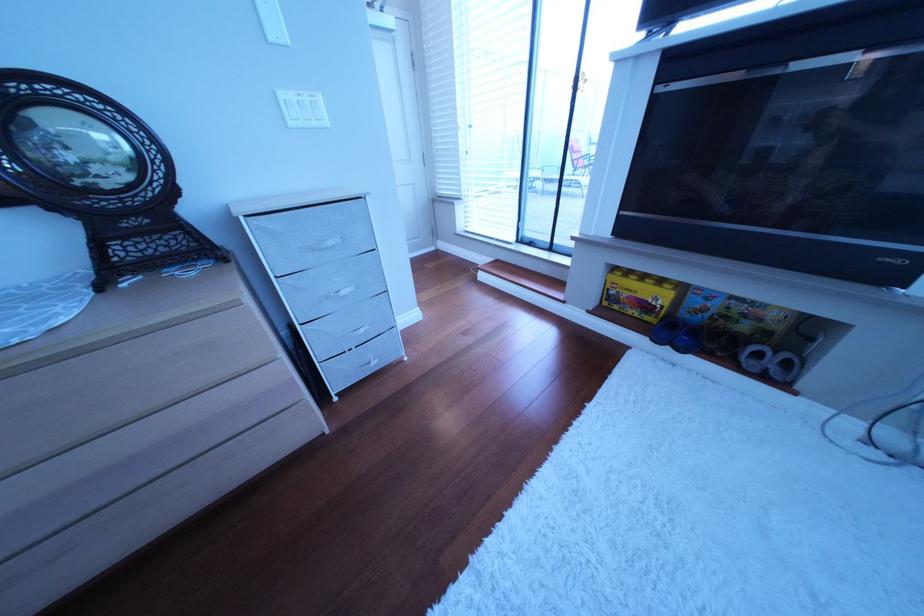
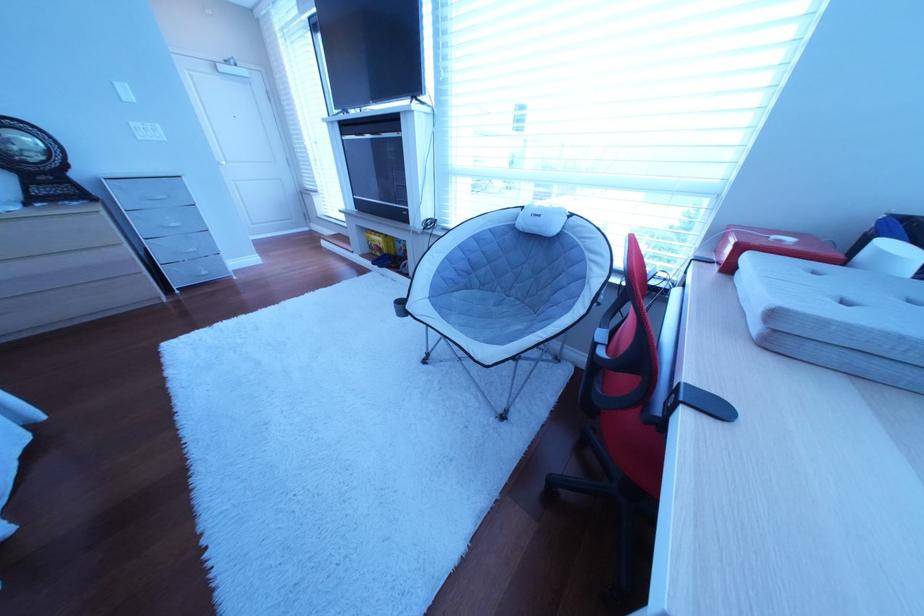
Which direction would the cameraman need to move to produce the second image?

The movement direction of the cameraman is right, backward.